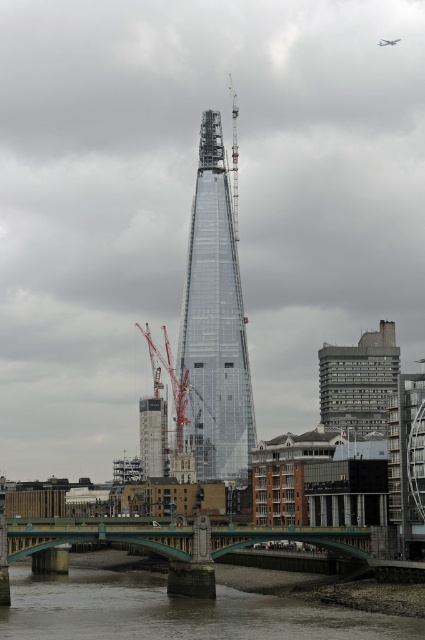
Can you confirm if glassy transparent building at center is positioned to the right of metallic silver airplane at upper center?

Incorrect, glassy transparent building at center is not on the right side of metallic silver airplane at upper center.

Does glassy transparent building at center lie behind metallic silver airplane at upper center?

No, it is in front of metallic silver airplane at upper center.

Which is in front, point (152, 408) or point (397, 38)?

Point (152, 408) is more forward.

You are a GUI agent. You are given a task and a screenshot of the screen. Output one action in this format:
    pyautogui.click(x=<x>, y=<y>)
    Task: Click on the glassy transparent building at center
    The image size is (425, 640).
    Given the screenshot: What is the action you would take?
    pyautogui.click(x=153, y=436)

How much distance is there between transparent glass tower at center and red metallic crane at center?

28.71 meters

Does transparent glass tower at center have a larger size compared to red metallic crane at center?

Yes, transparent glass tower at center is bigger than red metallic crane at center.

Is point (206, 435) positioned behind point (212, 419)?

That is True.

You are a GUI agent. You are given a task and a screenshot of the screen. Output one action in this format:
    pyautogui.click(x=<x>, y=<y>)
    Task: Click on the transparent glass tower at center
    Image resolution: width=425 pixels, height=640 pixels.
    Given the screenshot: What is the action you would take?
    pyautogui.click(x=215, y=317)

Who is positioned more to the right, brown sedimentary river at lower center or glassy transparent building at center?

brown sedimentary river at lower center

Is brown sedimentary river at lower center to the right of glassy transparent building at center from the viewer's perspective?

Indeed, brown sedimentary river at lower center is positioned on the right side of glassy transparent building at center.

This screenshot has width=425, height=640. Find the location of `brown sedimentary river at lower center`. brown sedimentary river at lower center is located at coordinates (175, 612).

Image resolution: width=425 pixels, height=640 pixels. In order to click on brown sedimentary river at lower center in this screenshot , I will do `click(175, 612)`.